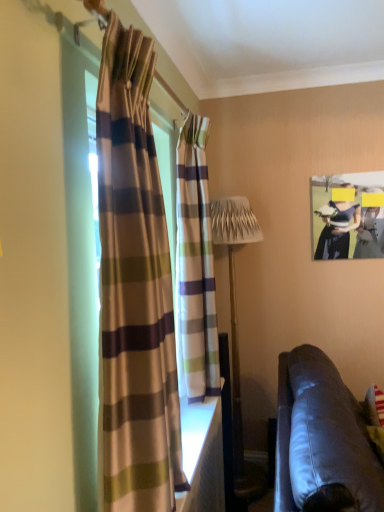
Question: Does striped fabric curtain at left, which is the 2th curtain in back-to-front order, have a lesser width compared to matte black hat at upper right?

Choices:
 (A) yes
 (B) no

Answer: (B)

Question: From the image's perspective, does striped fabric curtain at left, which is the 2th curtain in back-to-front order, appear lower than matte black hat at upper right?

Choices:
 (A) no
 (B) yes

Answer: (B)

Question: Does striped fabric curtain at left, which appears as the first curtain when viewed from the front, come in front of matte black hat at upper right?

Choices:
 (A) no
 (B) yes

Answer: (B)

Question: Is striped fabric curtain at left, which is the 2th curtain in back-to-front order, smaller than matte black hat at upper right?

Choices:
 (A) no
 (B) yes

Answer: (A)

Question: From a real-world perspective, is striped fabric curtain at left, which appears as the first curtain when viewed from the front, on matte black hat at upper right?

Choices:
 (A) no
 (B) yes

Answer: (A)

Question: Considering the positions of striped fabric curtain at left, which appears as the first curtain when viewed from the front, and leather couch at lower right in the image, is striped fabric curtain at left, which appears as the first curtain when viewed from the front, bigger or smaller than leather couch at lower right?

Choices:
 (A) small
 (B) big

Answer: (A)

Question: Considering the relative positions of striped fabric curtain at left, which appears as the first curtain when viewed from the front, and leather couch at lower right in the image provided, is striped fabric curtain at left, which appears as the first curtain when viewed from the front, to the left or to the right of leather couch at lower right?

Choices:
 (A) left
 (B) right

Answer: (A)

Question: Does point (160, 224) appear closer or farther from the camera than point (382, 490)?

Choices:
 (A) closer
 (B) farther

Answer: (A)

Question: In the image, is striped fabric curtain at left, which appears as the first curtain when viewed from the front, positioned in front of or behind leather couch at lower right?

Choices:
 (A) behind
 (B) front

Answer: (A)

Question: From the image's perspective, relative to striped fabric curtain at center, which is counted as the second curtain, starting from the front, is leather couch at lower right above or below?

Choices:
 (A) above
 (B) below

Answer: (B)

Question: From a real-world perspective, is leather couch at lower right positioned above or below striped fabric curtain at center, which is counted as the second curtain, starting from the front?

Choices:
 (A) below
 (B) above

Answer: (A)

Question: Visually, is leather couch at lower right positioned to the left or to the right of striped fabric curtain at center, which ranks as the 1th curtain in back-to-front order?

Choices:
 (A) right
 (B) left

Answer: (A)

Question: Does point (307, 478) appear closer or farther from the camera than point (205, 181)?

Choices:
 (A) closer
 (B) farther

Answer: (A)

Question: Would you say metallic silver table lamp at center is inside or outside leather couch at lower right?

Choices:
 (A) inside
 (B) outside

Answer: (B)

Question: Relative to leather couch at lower right, is metallic silver table lamp at center in front or behind?

Choices:
 (A) behind
 (B) front

Answer: (A)